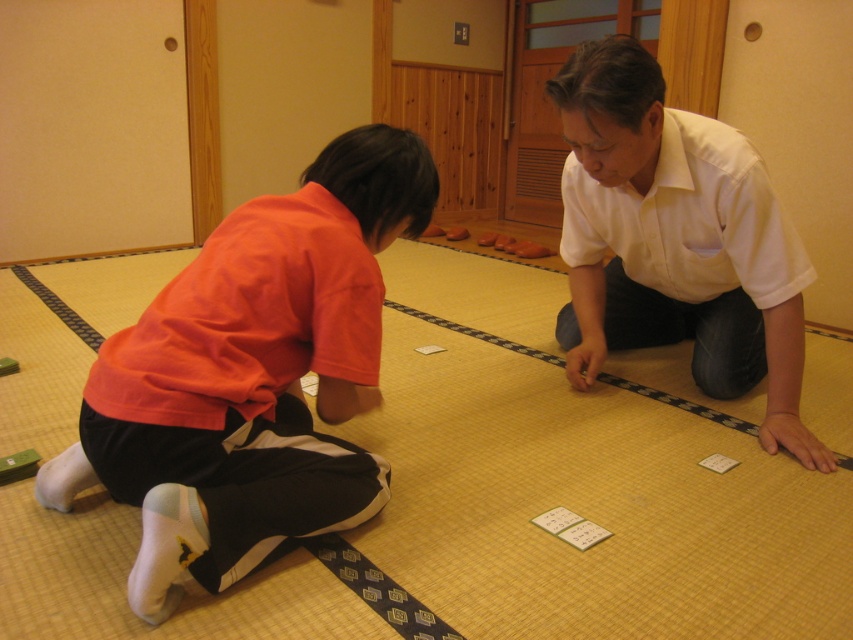
Question: Estimate the real-world distances between objects in this image. Which object is closer to the white paper cards at center?

Choices:
 (A) orange cotton shirt at lower left
 (B) white matte shirt at center

Answer: (A)

Question: Which point is closer to the camera?

Choices:
 (A) (564, 508)
 (B) (375, 380)
 (C) (625, 314)

Answer: (B)

Question: Considering the relative positions of white matte shirt at center and white paper cards at center in the image provided, where is white matte shirt at center located with respect to white paper cards at center?

Choices:
 (A) above
 (B) below

Answer: (A)

Question: From the image, what is the correct spatial relationship of white matte shirt at center in relation to white paper cards at center?

Choices:
 (A) above
 (B) below

Answer: (A)

Question: Which point is farther from the camera taking this photo?

Choices:
 (A) (782, 339)
 (B) (544, 529)
 (C) (289, 516)

Answer: (A)

Question: Is orange cotton shirt at lower left thinner than white paper cards at center?

Choices:
 (A) no
 (B) yes

Answer: (A)